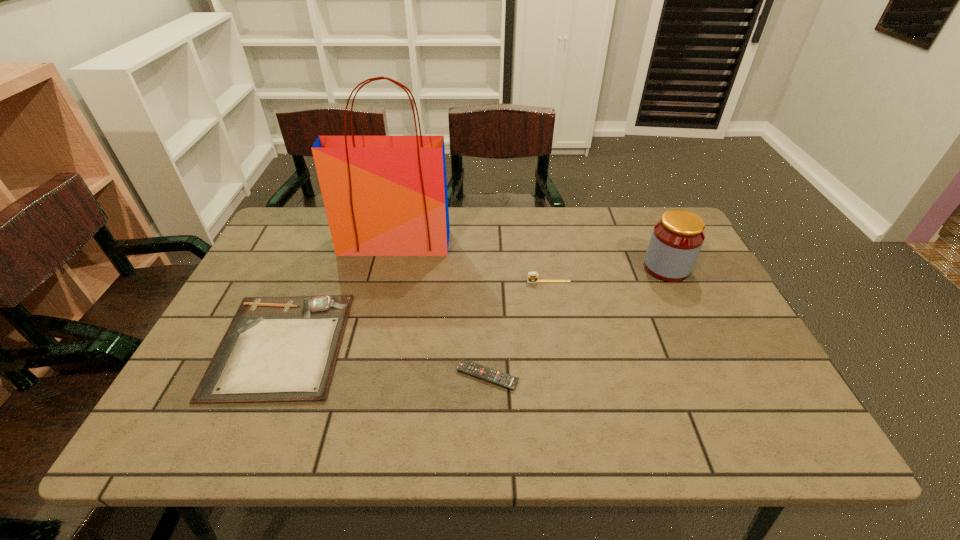
Identify the location of free space between the clipboard and the third shortest object. pyautogui.click(x=415, y=313).

Identify the location of free spot between the shopping bag and the clipboard. This screenshot has width=960, height=540. (338, 294).

Where is `vacant area between the third shortest object and the second shortest object`? Image resolution: width=960 pixels, height=540 pixels. vacant area between the third shortest object and the second shortest object is located at coordinates (415, 313).

The width and height of the screenshot is (960, 540). I want to click on free space between the second shortest object and the third object from left to right, so click(384, 360).

What are the coordinates of `empty space that is in between the fourth shortest object and the remote control` in the screenshot? It's located at (577, 322).

Find the location of `empty space that is in between the second tallest object and the third object from right to left`. empty space that is in between the second tallest object and the third object from right to left is located at coordinates (577, 322).

Locate an element on the screen. blank region between the third tallest object and the tallest object is located at coordinates (471, 262).

Image resolution: width=960 pixels, height=540 pixels. I want to click on empty space between the tape measure and the rightmost object, so click(x=608, y=275).

What are the coordinates of `empty space that is in between the tape measure and the clipboard` in the screenshot? It's located at (415, 313).

Locate an element on the screen. This screenshot has width=960, height=540. free space between the jar and the shortest object is located at coordinates tap(577, 322).